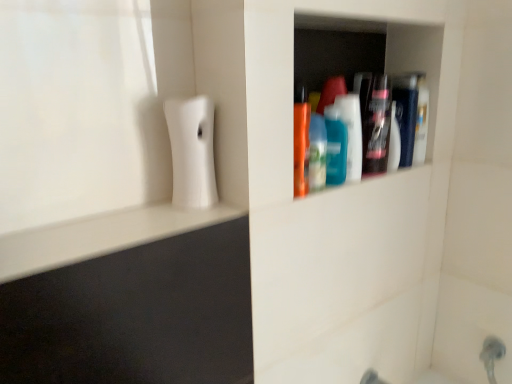
Question: Can you confirm if translucent plastic mouthwash at upper right, the third mouthwash when ordered from left to right, is smaller than translucent blue bottle at center, placed as the 1th mouthwash when sorted from left to right?

Choices:
 (A) yes
 (B) no

Answer: (B)

Question: Does translucent plastic mouthwash at upper right, placed as the 1th mouthwash when sorted from right to left, have a lesser height compared to translucent blue bottle at center, placed as the 1th mouthwash when sorted from left to right?

Choices:
 (A) no
 (B) yes

Answer: (A)

Question: Is translucent plastic mouthwash at upper right, placed as the 1th mouthwash when sorted from right to left, completely or partially outside of translucent blue bottle at center, positioned as the third mouthwash in right-to-left order?

Choices:
 (A) yes
 (B) no

Answer: (A)

Question: Is translucent plastic mouthwash at upper right, placed as the 1th mouthwash when sorted from right to left, aimed at translucent blue bottle at center, positioned as the third mouthwash in right-to-left order?

Choices:
 (A) no
 (B) yes

Answer: (A)

Question: Is translucent blue bottle at center, positioned as the third mouthwash in right-to-left order, at the back of translucent plastic mouthwash at upper right, placed as the 1th mouthwash when sorted from right to left?

Choices:
 (A) no
 (B) yes

Answer: (A)

Question: Is translucent plastic mouthwash at upper right, placed as the 1th mouthwash when sorted from right to left, inside the boundaries of translucent blue bottle at center, placed as the 1th mouthwash when sorted from left to right, or outside?

Choices:
 (A) outside
 (B) inside

Answer: (A)

Question: In terms of width, does translucent plastic mouthwash at upper right, placed as the 1th mouthwash when sorted from right to left, look wider or thinner when compared to translucent blue bottle at center, positioned as the third mouthwash in right-to-left order?

Choices:
 (A) wide
 (B) thin

Answer: (B)

Question: Considering their positions, is translucent plastic mouthwash at upper right, the third mouthwash when ordered from left to right, located in front of or behind translucent blue bottle at center, placed as the 1th mouthwash when sorted from left to right?

Choices:
 (A) front
 (B) behind

Answer: (B)

Question: Is point (404, 109) positioned closer to the camera than point (338, 129)?

Choices:
 (A) farther
 (B) closer

Answer: (A)

Question: From a real-world perspective, is translucent plastic mouthwash at upper right, placed as the 1th mouthwash when sorted from right to left, physically located above or below teal glossy mouthwash at center, the second mouthwash when ordered from left to right?

Choices:
 (A) below
 (B) above

Answer: (B)

Question: Is translucent plastic mouthwash at upper right, the third mouthwash when ordered from left to right, wider or thinner than teal glossy mouthwash at center, which is the 2th mouthwash in right-to-left order?

Choices:
 (A) thin
 (B) wide

Answer: (B)

Question: Is translucent plastic mouthwash at upper right, placed as the 1th mouthwash when sorted from right to left, taller or shorter than teal glossy mouthwash at center, which is the 2th mouthwash in right-to-left order?

Choices:
 (A) tall
 (B) short

Answer: (A)

Question: From the image's perspective, relative to teal glossy mouthwash at center, which is the 2th mouthwash in right-to-left order, is translucent plastic mouthwash at upper right, placed as the 1th mouthwash when sorted from right to left, above or below?

Choices:
 (A) below
 (B) above

Answer: (B)

Question: Looking at their shapes, would you say teal glossy mouthwash at center, the second mouthwash when ordered from left to right, is wider or thinner than translucent plastic mouthwash at upper right, the third mouthwash when ordered from left to right?

Choices:
 (A) thin
 (B) wide

Answer: (A)

Question: From the image's perspective, relative to translucent plastic mouthwash at upper right, placed as the 1th mouthwash when sorted from right to left, is teal glossy mouthwash at center, which is the 2th mouthwash in right-to-left order, above or below?

Choices:
 (A) above
 (B) below

Answer: (B)